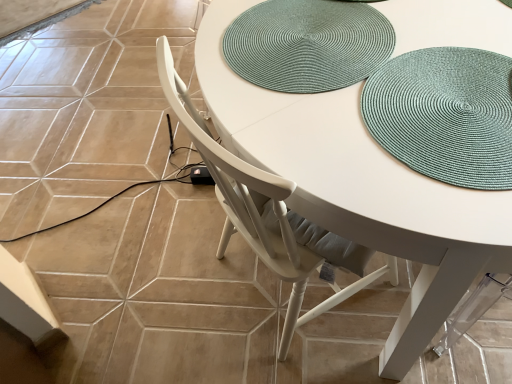
At what (x,y) coordinates should I click in order to perform the action: click on free space that is in between teal woven placemat at upper center and teal woven placemat at upper right. Please return your answer as a coordinate pair (x, y). Looking at the image, I should click on (371, 78).